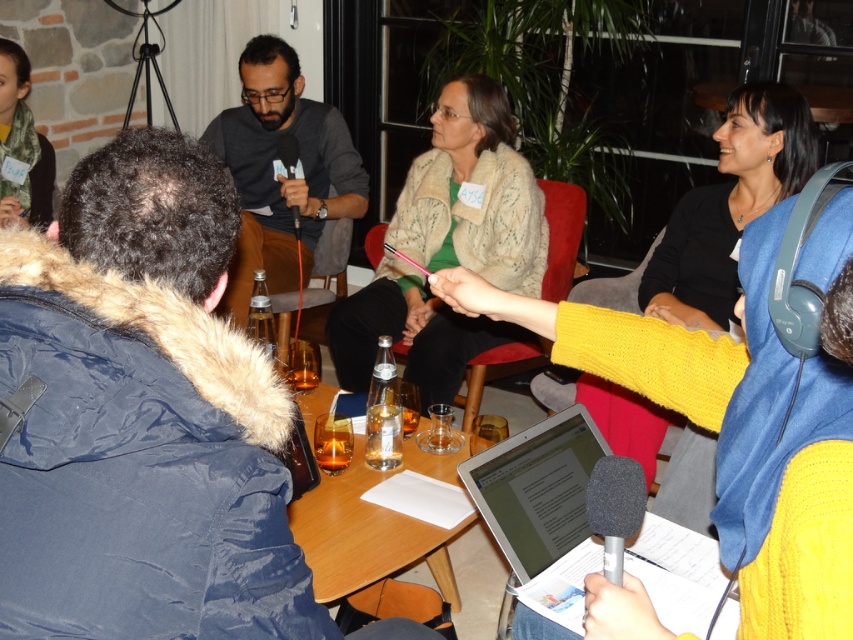
Question: Which of the following is the closest to the observer?

Choices:
 (A) (299, 88)
 (B) (323, 454)
 (C) (287, 380)
 (D) (289, 170)

Answer: (B)

Question: Does silver metallic laptop at center appear on the right side of clear wood table at center?

Choices:
 (A) no
 (B) yes

Answer: (B)

Question: Does clear wood table at center appear on the left side of translucent glass at table center?

Choices:
 (A) no
 (B) yes

Answer: (A)

Question: Among these points, which one is nearest to the camera?

Choices:
 (A) (288, 170)
 (B) (589, 550)

Answer: (B)

Question: Which is nearer to the fuzzy white coat at center?

Choices:
 (A) clear glass bottle at center
 (B) black matte microphone at center

Answer: (B)

Question: Is silver metallic laptop at center below translucent glass at table center?

Choices:
 (A) no
 (B) yes

Answer: (B)